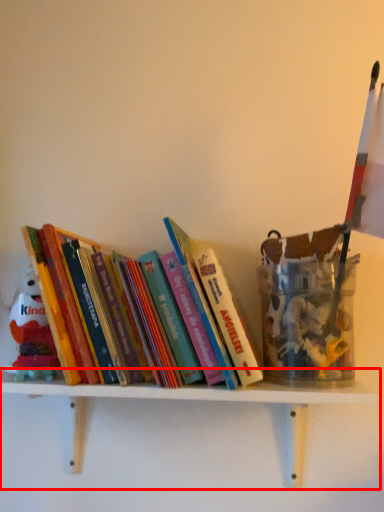
Question: From the image, what is the correct spatial relationship of shelf (annotated by the red box) in relation to book?

Choices:
 (A) left
 (B) right

Answer: (B)